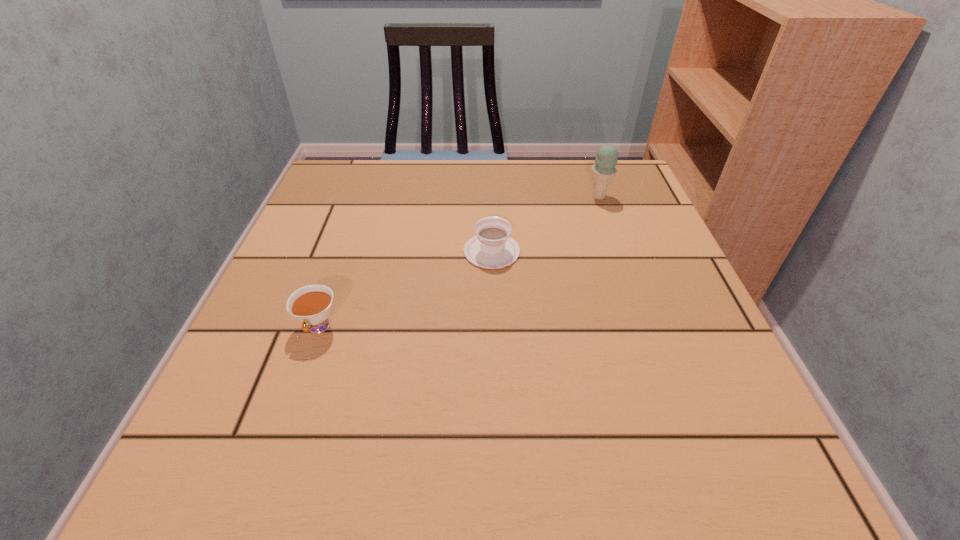
At what (x,y) coordinates should I click in order to perform the action: click on the tallest object. Please return your answer as a coordinate pair (x, y). This screenshot has height=540, width=960. Looking at the image, I should click on point(604,170).

The height and width of the screenshot is (540, 960). In order to click on the farthest object in this screenshot , I will do `click(604, 170)`.

The height and width of the screenshot is (540, 960). Find the location of `the nearest object`. the nearest object is located at coordinates (311, 305).

The height and width of the screenshot is (540, 960). Identify the location of the leftmost object. (311, 305).

Where is `the second farthest object`? The height and width of the screenshot is (540, 960). the second farthest object is located at coordinates (492, 247).

Image resolution: width=960 pixels, height=540 pixels. Identify the location of the farther teacup. (492, 247).

Image resolution: width=960 pixels, height=540 pixels. I want to click on vacant region located 0.370m on the left of the farthest object, so click(x=427, y=197).

Identify the location of free space located 0.210m on the side of the left teacup with the handle. (265, 481).

Locate an element on the screen. free space located 0.080m on the handle side of the second object from left to right is located at coordinates (491, 212).

The height and width of the screenshot is (540, 960). What are the coordinates of `free space located on the handle side of the second object from left to right` in the screenshot? It's located at (489, 164).